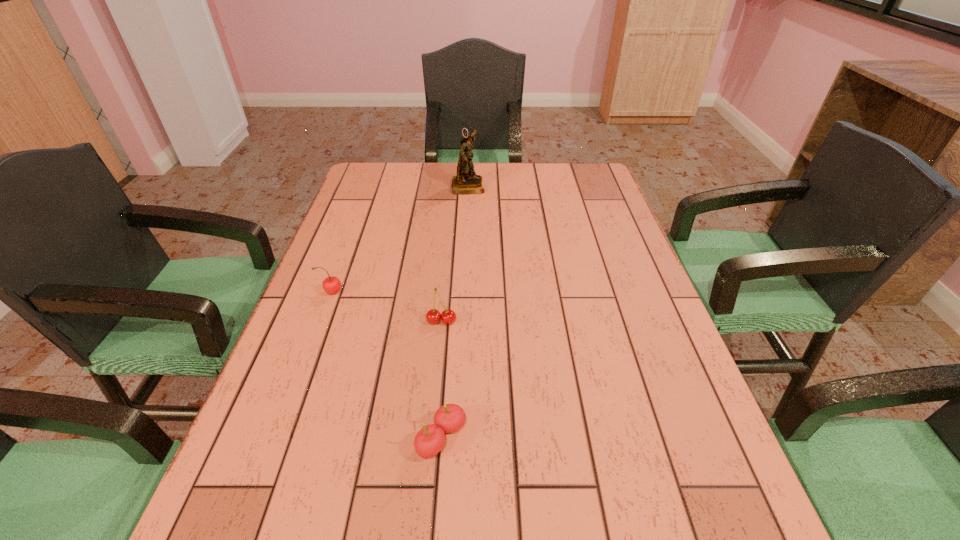
Locate an element on the screen. vacant space in between the nearest cherry and the second farthest cherry is located at coordinates (442, 380).

Locate an element on the screen. The image size is (960, 540). free point between the nearest cherry and the third nearest object is located at coordinates (387, 365).

Identify the location of vacant area that lies between the nearest object and the tallest object. Image resolution: width=960 pixels, height=540 pixels. (455, 312).

Locate an element on the screen. Image resolution: width=960 pixels, height=540 pixels. vacant point located between the figurine and the nearest cherry is located at coordinates (455, 312).

The width and height of the screenshot is (960, 540). In order to click on free point between the figurine and the second nearest object in this screenshot , I will do `click(455, 253)`.

This screenshot has width=960, height=540. I want to click on vacant area that lies between the second farthest cherry and the farthest cherry, so click(387, 307).

At what (x,y) coordinates should I click in order to perform the action: click on empty location between the second farthest cherry and the tallest object. Please return your answer as a coordinate pair (x, y). Looking at the image, I should click on (455, 253).

Point out which object is positioned as the nearest to the third nearest object. Please provide its 2D coordinates. Your answer should be formatted as a tuple, i.e. [(x, y)], where the tuple contains the x and y coordinates of a point satisfying the conditions above.

[(433, 316)]

Where is `the third closest object relative to the second nearest cherry`? The image size is (960, 540). the third closest object relative to the second nearest cherry is located at coordinates (466, 182).

You are a GUI agent. You are given a task and a screenshot of the screen. Output one action in this format:
    pyautogui.click(x=<x>, y=<y>)
    Task: Click on the cherry that stands as the closest to the leftmost cherry
    The image size is (960, 540).
    Given the screenshot: What is the action you would take?
    pyautogui.click(x=433, y=316)